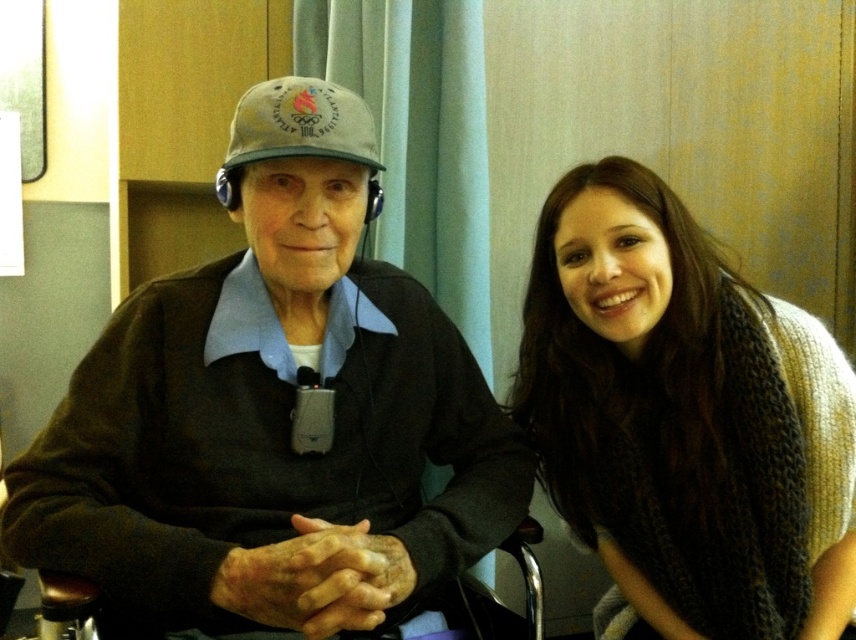
Does knitted scarf at right lie behind khaki fabric baseball cap at upper center?

Yes.

In the scene shown: Can you confirm if knitted scarf at right is thinner than khaki fabric baseball cap at upper center?

In fact, knitted scarf at right might be wider than khaki fabric baseball cap at upper center.

At what (x,y) coordinates should I click in order to perform the action: click on knitted scarf at right. Please return your answer as a coordinate pair (x, y). Looking at the image, I should click on (685, 420).

Who is more forward, (327, 602) or (669, 566)?

Point (327, 602)

The image size is (856, 640). Describe the element at coordinates (272, 412) in the screenshot. I see `matte gray cap at center` at that location.

Between point (132, 524) and point (739, 356), which one is positioned behind?

Positioned behind is point (739, 356).

Identify the location of matte gray cap at center. This screenshot has width=856, height=640. (272, 412).

Which is in front, point (194, 556) or point (340, 116)?

Positioned in front is point (194, 556).

Can you confirm if matte gray cap at center is thinner than khaki fabric baseball cap at upper center?

Incorrect, matte gray cap at center's width is not less than khaki fabric baseball cap at upper center's.

Between point (305, 288) and point (235, 120), which one is positioned behind?

The point (305, 288) is behind.

Where is `matte gray cap at center`? matte gray cap at center is located at coordinates (272, 412).